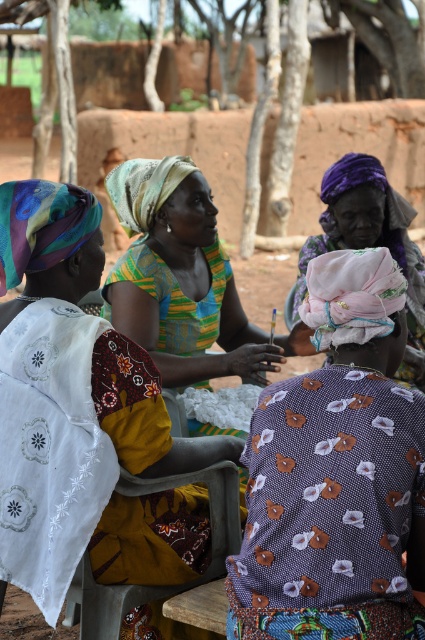
Question: Which object is closer to the camera taking this photo?

Choices:
 (A) purple printed fabric at center
 (B) purple fabric headscarf at center
 (C) embroidered cotton dress at left

Answer: (A)

Question: Based on their relative distances, which object is nearer to the purple fabric headscarf at center?

Choices:
 (A) embroidered cotton dress at left
 (B) purple printed fabric at center

Answer: (B)

Question: Does embroidered cotton dress at left have a greater width compared to purple fabric headscarf at center?

Choices:
 (A) no
 (B) yes

Answer: (B)

Question: Which object appears farthest from the camera in this image?

Choices:
 (A) purple printed fabric at center
 (B) embroidered cotton dress at left
 (C) purple fabric headscarf at center

Answer: (C)

Question: Is purple printed fabric at center wider than purple fabric headscarf at center?

Choices:
 (A) yes
 (B) no

Answer: (B)

Question: Is the position of purple printed fabric at center less distant than that of purple fabric headscarf at center?

Choices:
 (A) yes
 (B) no

Answer: (A)